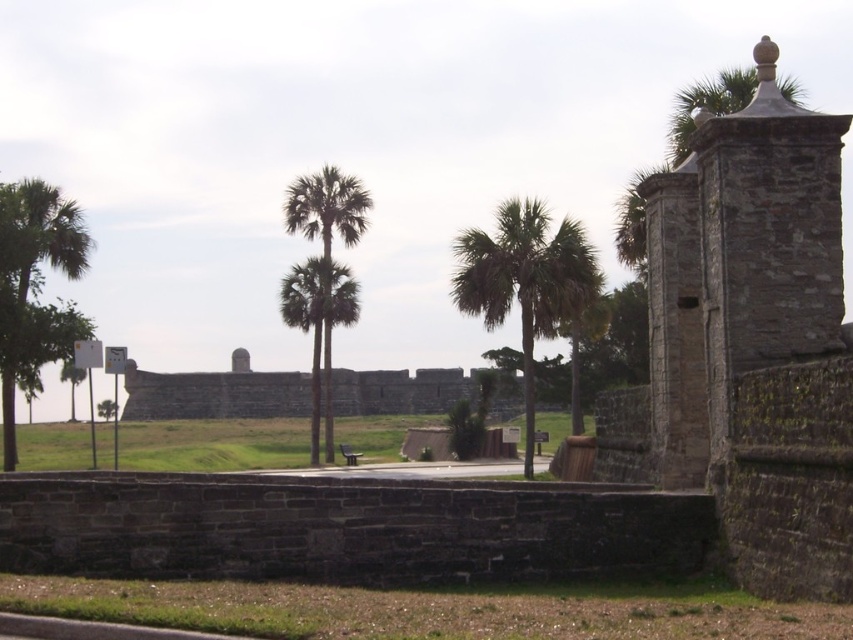
Question: Which point is farther from the camera taking this photo?

Choices:
 (A) tap(338, 212)
 (B) tap(555, 320)
 (C) tap(54, 234)

Answer: (A)

Question: From the image, what is the correct spatial relationship of green leafy palm tree at center in relation to green leafy palm trees at center?

Choices:
 (A) above
 (B) below

Answer: (B)

Question: Which point is farther to the camera?

Choices:
 (A) green leafy palm tree at center
 (B) green leafy palm tree at left

Answer: (B)

Question: Does green leafy palm tree at left appear over green leafy palm trees at center?

Choices:
 (A) yes
 (B) no

Answer: (B)

Question: From the image, what is the correct spatial relationship of green leafy palm tree at center in relation to green leafy palm trees at center?

Choices:
 (A) right
 (B) left

Answer: (A)

Question: Which point appears closest to the camera in this image?

Choices:
 (A) (352, 216)
 (B) (461, 266)

Answer: (B)